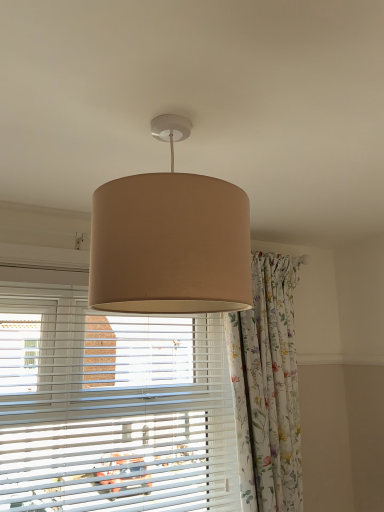
Question: From the image's perspective, is floral fabric curtain at center located beneath beige fabric lampshade at center?

Choices:
 (A) no
 (B) yes

Answer: (B)

Question: Does floral fabric curtain at center have a smaller size compared to beige fabric lampshade at center?

Choices:
 (A) no
 (B) yes

Answer: (A)

Question: Are floral fabric curtain at center and beige fabric lampshade at center making contact?

Choices:
 (A) yes
 (B) no

Answer: (B)

Question: Is floral fabric curtain at center not inside beige fabric lampshade at center?

Choices:
 (A) yes
 (B) no

Answer: (A)

Question: Is floral fabric curtain at center looking in the opposite direction of beige fabric lampshade at center?

Choices:
 (A) no
 (B) yes

Answer: (A)

Question: Considering their positions, is floral fabric curtain at center located in front of or behind white plastic blinds at center?

Choices:
 (A) behind
 (B) front

Answer: (A)

Question: From a real-world perspective, is floral fabric curtain at center positioned above or below white plastic blinds at center?

Choices:
 (A) above
 (B) below

Answer: (A)

Question: Is point (268, 462) positioned closer to the camera than point (150, 346)?

Choices:
 (A) closer
 (B) farther

Answer: (A)

Question: In terms of height, does floral fabric curtain at center look taller or shorter compared to white plastic blinds at center?

Choices:
 (A) short
 (B) tall

Answer: (B)

Question: Visually, is beige fabric lampshade at center positioned to the left or to the right of floral fabric curtain at center?

Choices:
 (A) left
 (B) right

Answer: (A)

Question: Is beige fabric lampshade at center inside or outside of floral fabric curtain at center?

Choices:
 (A) inside
 (B) outside

Answer: (B)

Question: In terms of height, does beige fabric lampshade at center look taller or shorter compared to floral fabric curtain at center?

Choices:
 (A) tall
 (B) short

Answer: (B)

Question: Considering the positions of beige fabric lampshade at center and floral fabric curtain at center in the image, is beige fabric lampshade at center bigger or smaller than floral fabric curtain at center?

Choices:
 (A) big
 (B) small

Answer: (B)

Question: Is floral fabric curtain at center in front of or behind beige fabric lampshade at center in the image?

Choices:
 (A) behind
 (B) front

Answer: (A)

Question: Considering the positions of floral fabric curtain at center and beige fabric lampshade at center in the image, is floral fabric curtain at center wider or thinner than beige fabric lampshade at center?

Choices:
 (A) thin
 (B) wide

Answer: (A)